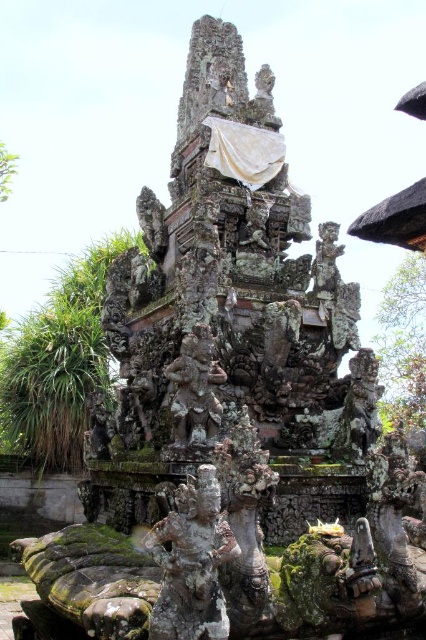
You are a temple guide explaining the layout of the temple. You mention both the bronze statue at center and the carved stone statue at upper center. Which statue is wider?

The bronze statue at center is wider than the carved stone statue at upper center.

You are an architect visiting the temple and need to place a new decorative element between the green stone statue at center and the rusty stone statue at center. Which statue should you place it closer to if you want the element to be closer to the wider statue?

You should place the new decorative element closer to the green stone statue at center because its width is larger than the rusty stone statue at center.